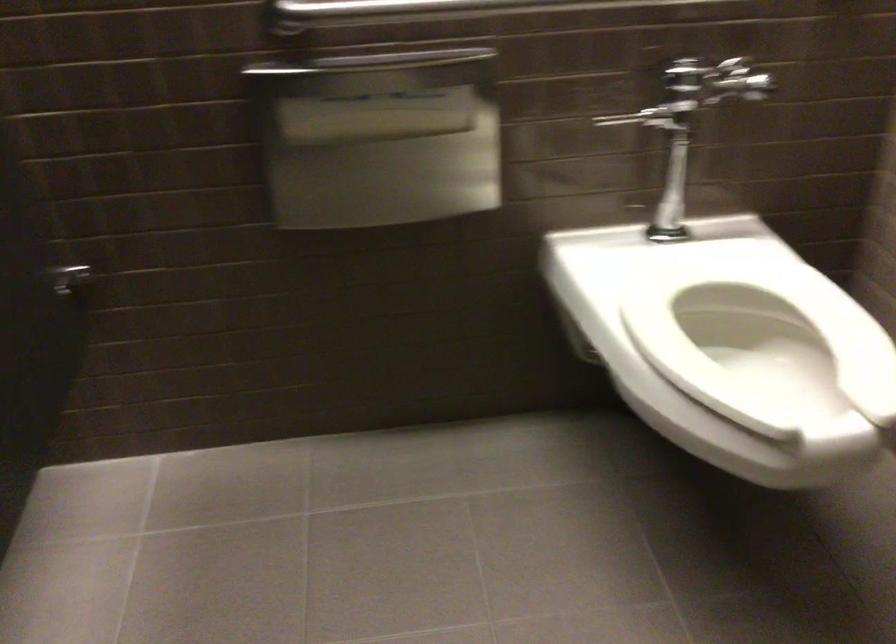
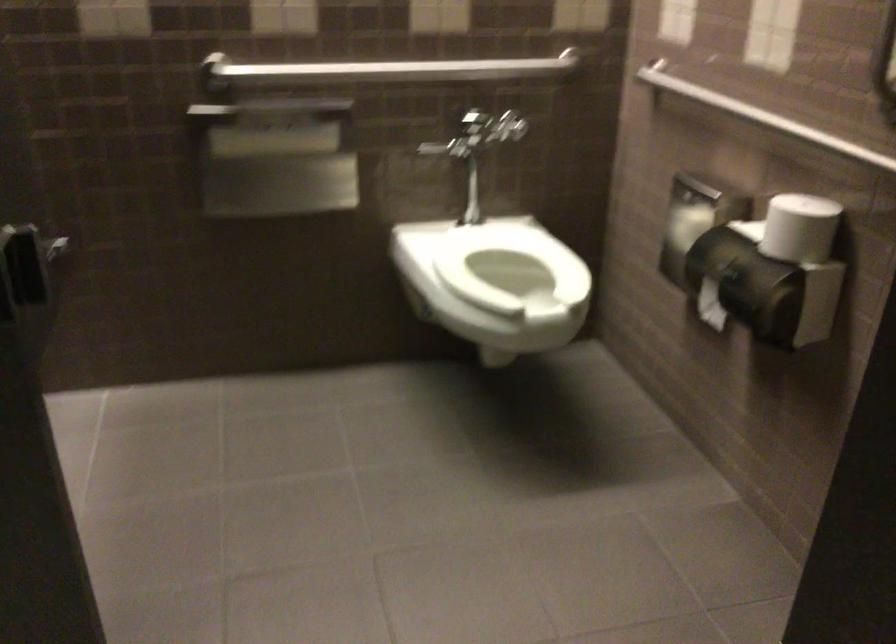
Question: Which direction would the cameraman need to move to produce the second image? Reply with the corresponding letter.

Choices:
 (A) Left
 (B) Right
 (C) Forward
 (D) Backward

Answer: (D)